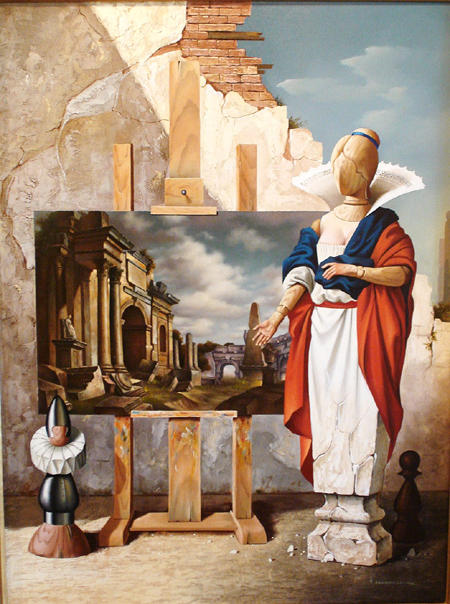
The height and width of the screenshot is (604, 450). In order to click on floor in this screenshot , I will do `click(170, 580)`.